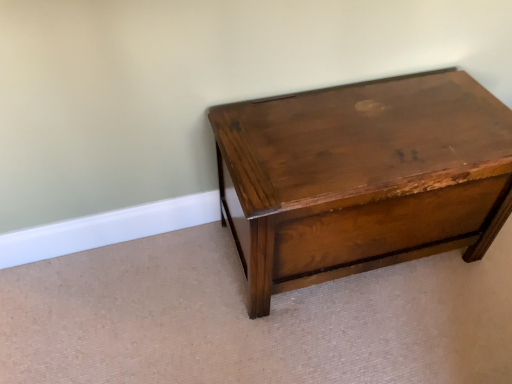
Find the location of a particular element. This screenshot has width=512, height=384. free space in front of shiny brown wood chest at center is located at coordinates (371, 336).